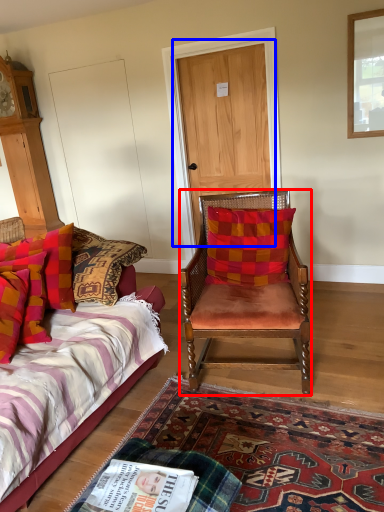
Question: Which object is further to the camera taking this photo, chair (highlighted by a red box) or door (highlighted by a blue box)?

Choices:
 (A) chair
 (B) door

Answer: (B)